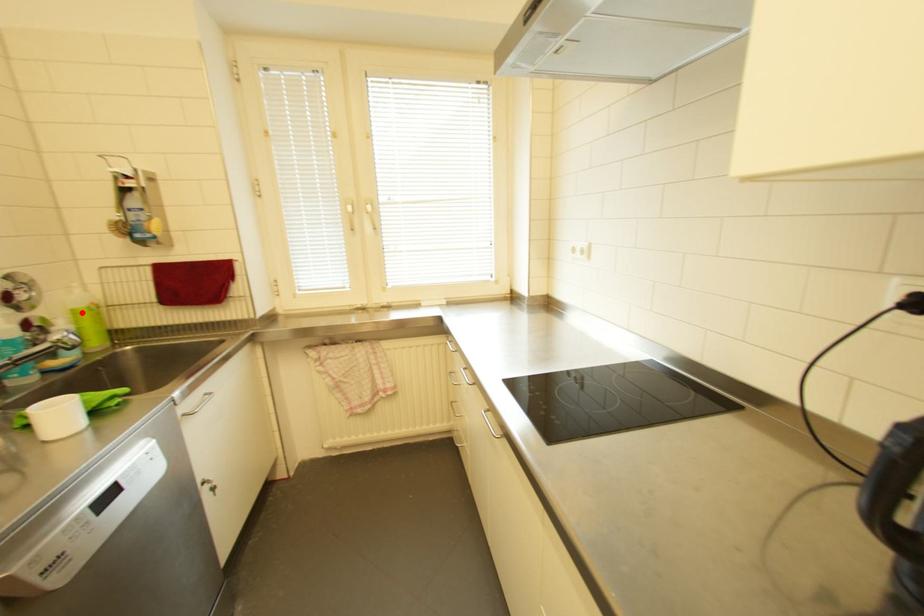
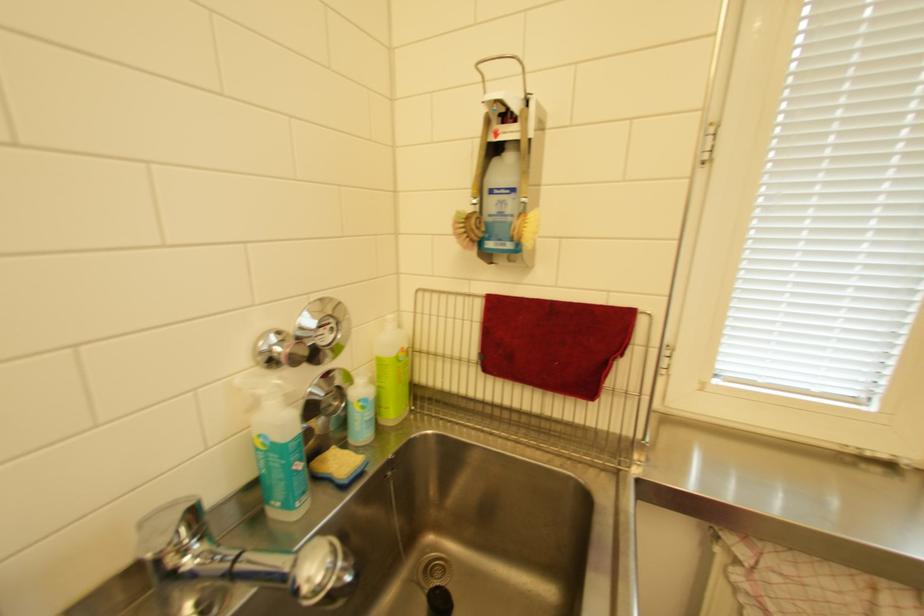
Locate, in the second image, the point that corresponds to the highlighted location in the first image.

(386, 362)